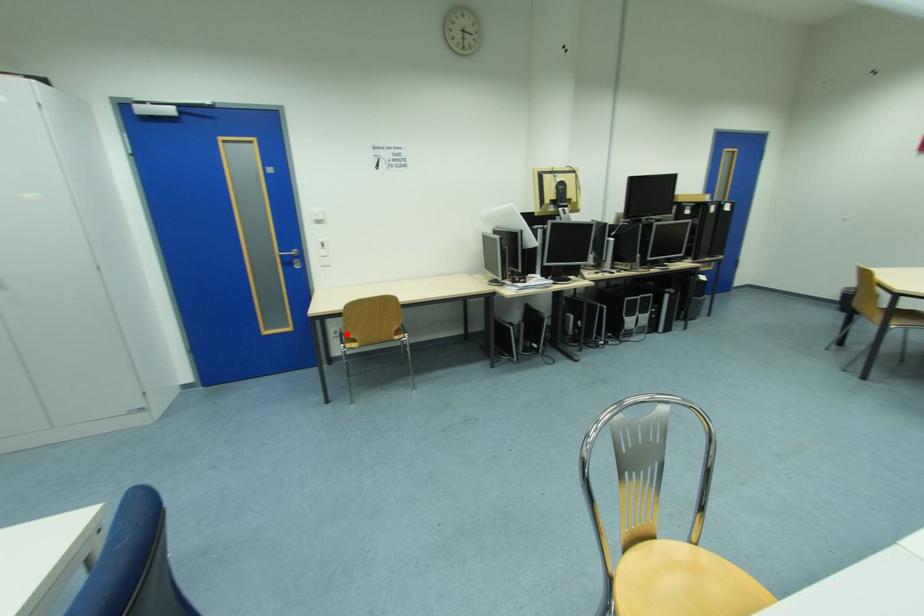
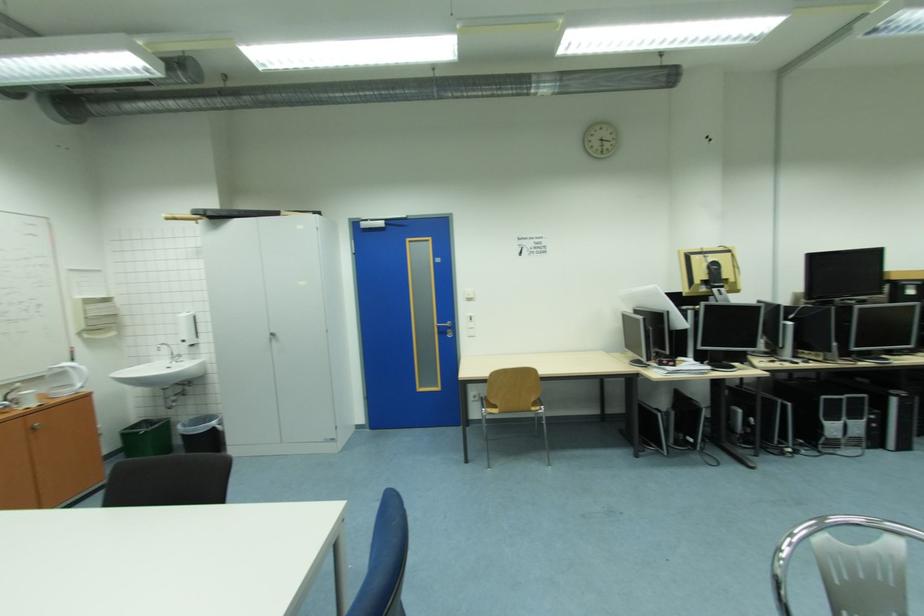
Question: I am providing you with two images of the same scene from different viewpoints. A red point is marked on the first image. Is the red point's position out of view in image 2?

Choices:
 (A) Yes
 (B) No

Answer: (B)